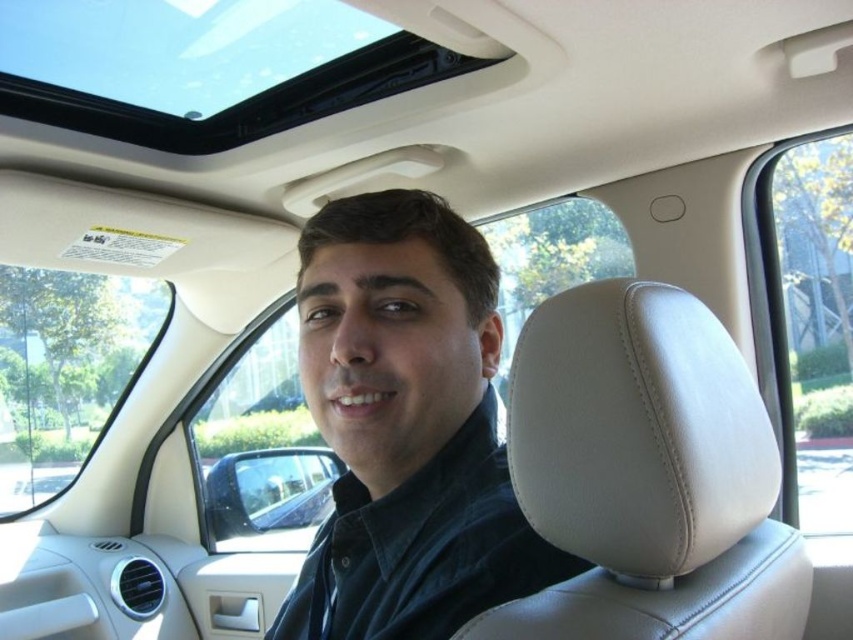
Is point (570, 470) positioned after point (309, 364)?

No, it is in front of (309, 364).

Between beige leather headrest at center and matte black shirt at center, which one is positioned higher?

matte black shirt at center is higher up.

Is point (526, 376) farther from viewer compared to point (436, 484)?

No, (526, 376) is closer to viewer.

What are the coordinates of `beige leather headrest at center` in the screenshot? It's located at (646, 474).